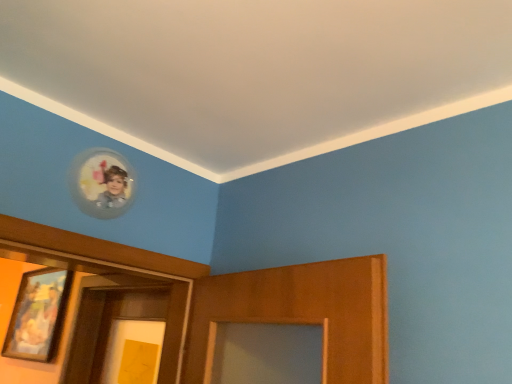
Question: Is point (106, 205) closer or farther from the camera than point (31, 357)?

Choices:
 (A) farther
 (B) closer

Answer: (B)

Question: Is clear glass portrait at upper left, the first picture frame in the right-to-left sequence, bigger or smaller than wooden framed painting at left, which is counted as the second picture frame, starting from the top?

Choices:
 (A) small
 (B) big

Answer: (A)

Question: From the image's perspective, is clear glass portrait at upper left, which is the first picture frame in top-to-bottom order, positioned above or below wooden framed painting at left, the first picture frame from the left?

Choices:
 (A) below
 (B) above

Answer: (B)

Question: Based on their positions, is wooden framed painting at left, which is the second picture frame from right to left, located to the left or right of clear glass portrait at upper left, the 2th picture frame from the bottom?

Choices:
 (A) right
 (B) left

Answer: (B)

Question: In the image, is wooden framed painting at left, the first picture frame from the left, positioned in front of or behind clear glass portrait at upper left, the 2th picture frame when ordered from left to right?

Choices:
 (A) behind
 (B) front

Answer: (A)

Question: Based on their sizes in the image, would you say wooden framed painting at left, which is the second picture frame from right to left, is bigger or smaller than clear glass portrait at upper left, the 2th picture frame when ordered from left to right?

Choices:
 (A) small
 (B) big

Answer: (B)

Question: Is wooden framed painting at left, which is the second picture frame from right to left, wider or thinner than clear glass portrait at upper left, the 2th picture frame when ordered from left to right?

Choices:
 (A) thin
 (B) wide

Answer: (B)